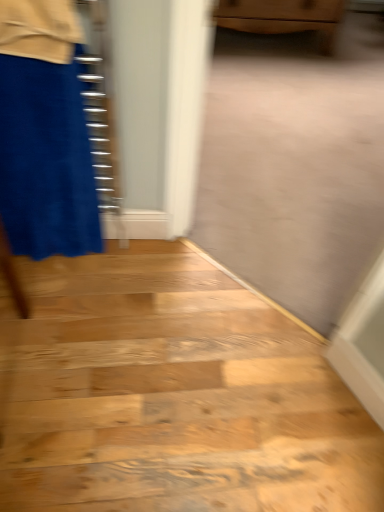
Question: Is wooden floor at lower left in front of or behind velvet blue miniskirt at left in the image?

Choices:
 (A) behind
 (B) front

Answer: (A)

Question: Does point (71, 406) appear closer or farther from the camera than point (36, 254)?

Choices:
 (A) closer
 (B) farther

Answer: (A)

Question: Which object is positioned farthest from the wooden floor at lower left?

Choices:
 (A) velvet blue miniskirt at left
 (B) wooden cabinet at upper center

Answer: (B)

Question: Which is nearer to the wooden floor at lower left?

Choices:
 (A) wooden cabinet at upper center
 (B) velvet blue miniskirt at left

Answer: (B)